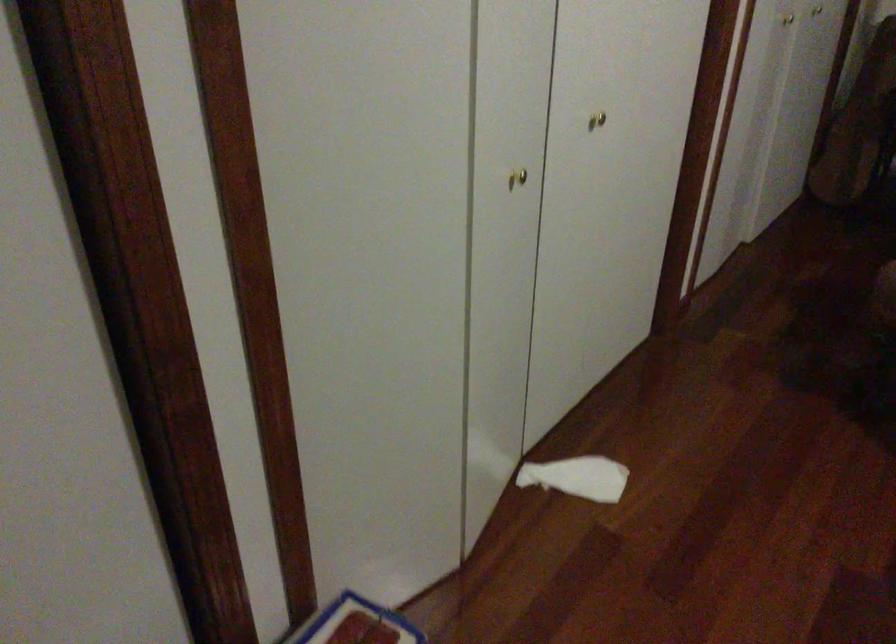
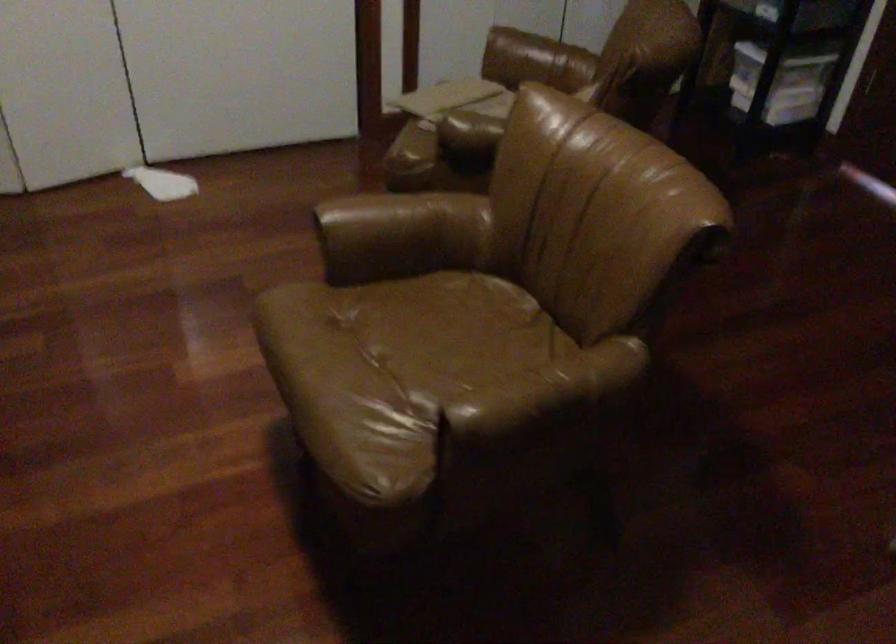
Question: In a continuous first-person perspective shot, in which direction is the camera moving?

Choices:
 (A) Left
 (B) Right
 (C) Forward
 (D) Backward

Answer: (B)